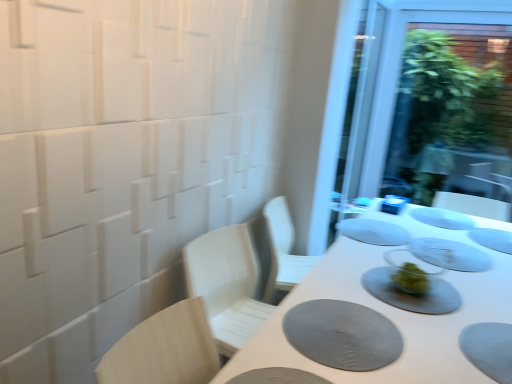
Locate an element on the screen. The height and width of the screenshot is (384, 512). free location above gray matte placemat at center, positioned as the 3th tableware in front-to-back order (from a real-world perspective) is located at coordinates (490, 235).